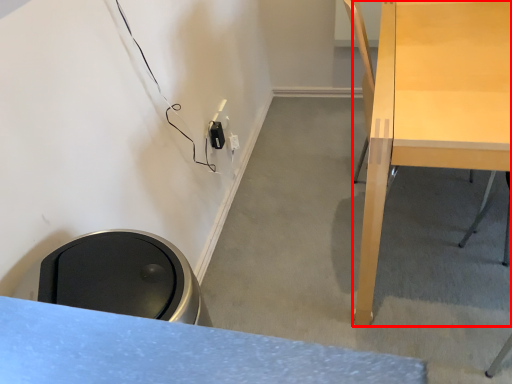
Question: From the image's perspective, where is desk (annotated by the red box) located in relation to electric outlet in the image?

Choices:
 (A) above
 (B) below

Answer: (B)